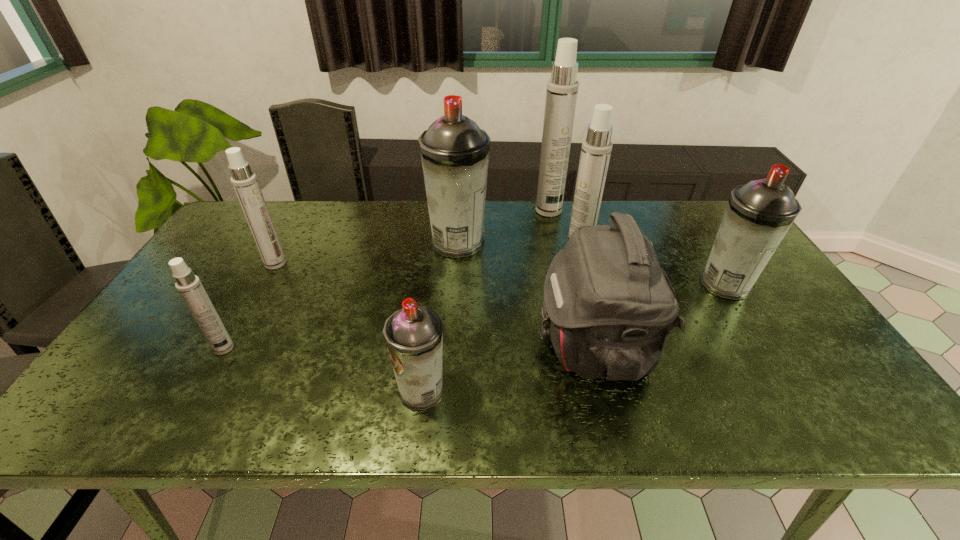
Where is `blank area located on the right of the nearest white aerosol can`? blank area located on the right of the nearest white aerosol can is located at coordinates (287, 348).

I want to click on vacant space situated 0.280m on the left of the smallest gray aerosol can, so click(x=270, y=391).

The image size is (960, 540). Find the location of `shoulder bag that is at the near edge`. shoulder bag that is at the near edge is located at coordinates (609, 308).

The height and width of the screenshot is (540, 960). Find the location of `aerosol can at the near edge`. aerosol can at the near edge is located at coordinates (414, 334).

I want to click on object at the right edge, so click(758, 215).

Find the location of `vacant space at the far edge`. vacant space at the far edge is located at coordinates (360, 217).

This screenshot has width=960, height=540. Identify the location of free space at the near edge of the desktop. (181, 424).

I want to click on free region at the left edge, so click(x=215, y=279).

You are a GUI agent. You are given a task and a screenshot of the screen. Output one action in this format:
    pyautogui.click(x=<x>, y=<y>)
    Task: Click on the vacant area at the far left corner
    The height and width of the screenshot is (540, 960).
    Given the screenshot: What is the action you would take?
    pyautogui.click(x=273, y=207)

Identify the location of vacant space at the far right corner. The image size is (960, 540). (715, 211).